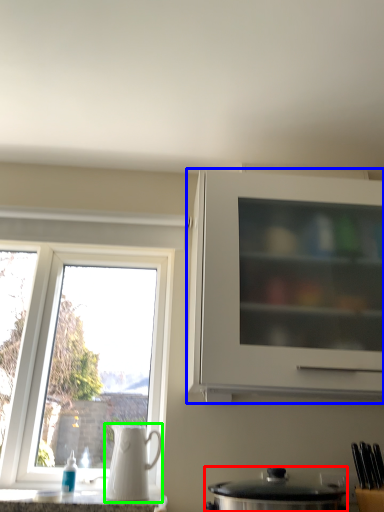
Question: Estimate the real-world distances between objects in this image. Which object is closer to kitchen appliance (highlighted by a red box), cabinetry (highlighted by a blue box) or jug (highlighted by a green box)?

Choices:
 (A) cabinetry
 (B) jug

Answer: (B)